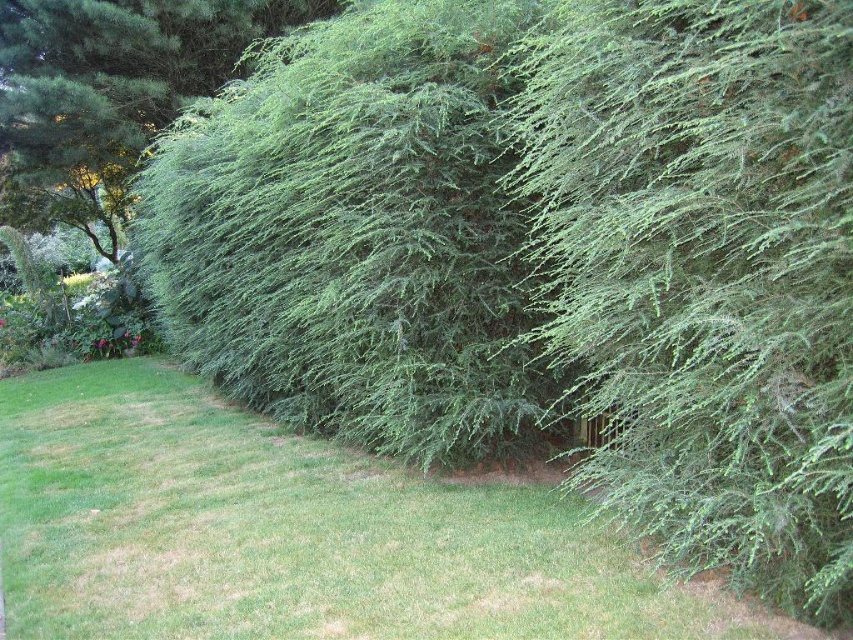
Which is more to the left, green needle-like at center or green needle-like at left?

From the viewer's perspective, green needle-like at left appears more on the left side.

Does green needle-like at center have a lesser width compared to green needle-like at left?

In fact, green needle-like at center might be wider than green needle-like at left.

Between point (581, 209) and point (99, 116), which one is positioned in front?

Point (581, 209) is more forward.

In order to click on green needle-like at center in this screenshot , I will do click(x=701, y=273).

Which of these two, green needle-like at center or green leafy bush at center, stands taller?

Standing taller between the two is green needle-like at center.

Does green needle-like at center have a greater height compared to green leafy bush at center?

Indeed, green needle-like at center has a greater height compared to green leafy bush at center.

Is point (753, 305) in front of point (283, 108)?

Yes, it is in front of point (283, 108).

The width and height of the screenshot is (853, 640). I want to click on green needle-like at center, so click(x=701, y=273).

Who is lower down, green leafy bush at center or green needle-like at left?

green leafy bush at center is below.

Can you confirm if green leafy bush at center is taller than green needle-like at left?

Yes.

Who is more distant from viewer, [173,348] or [91,32]?

The point [173,348] is behind.

At what (x,y) coordinates should I click in order to perform the action: click on green leafy bush at center. Please return your answer as a coordinate pair (x, y). This screenshot has width=853, height=640. Looking at the image, I should click on (357, 236).